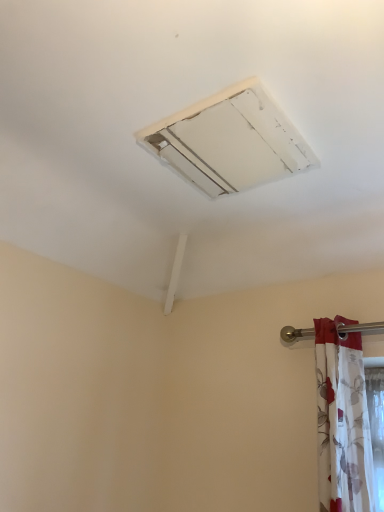
Measure the distance between white matte air conditioning at upper center and camera.

white matte air conditioning at upper center is 36.63 inches from camera.

What do you see at coordinates (230, 141) in the screenshot?
I see `white matte air conditioning at upper center` at bounding box center [230, 141].

Identify the location of white matte air conditioning at upper center. (230, 141).

In order to face white matte air conditioning at upper center, should I rotate leftwards or rightwards?

Rotate right and turn 5.297 degrees.

In order to click on white floral fabric at right in this screenshot , I will do `click(342, 421)`.

Measure the distance between point (338, 370) and camera.

Point (338, 370) is 4.43 feet from camera.

What do you see at coordinates (342, 421) in the screenshot? I see `white floral fabric at right` at bounding box center [342, 421].

Where is `white matte air conditioning at upper center`? white matte air conditioning at upper center is located at coordinates (x=230, y=141).

Visually, is white matte air conditioning at upper center positioned to the left or to the right of white floral fabric at right?

white matte air conditioning at upper center is to the left of white floral fabric at right.

Is white matte air conditioning at upper center behind white floral fabric at right?

No, the depth of white matte air conditioning at upper center is less than that of white floral fabric at right.

Considering the points (267, 142) and (320, 487), which point is behind, point (267, 142) or point (320, 487)?

The point (320, 487) is farther from the camera.

From the image's perspective, does white matte air conditioning at upper center appear lower than white floral fabric at right?

No, from the image's perspective, white matte air conditioning at upper center is not beneath white floral fabric at right.

From a real-world perspective, which object rests below the other?

white floral fabric at right.

Which of these two, white matte air conditioning at upper center or white floral fabric at right, is thinner?

white floral fabric at right is thinner.

Consider the image. Considering the sizes of white matte air conditioning at upper center and white floral fabric at right in the image, is white matte air conditioning at upper center taller or shorter than white floral fabric at right?

white matte air conditioning at upper center is shorter than white floral fabric at right.

Between white matte air conditioning at upper center and white floral fabric at right, which one has larger size?

With larger size is white floral fabric at right.

Based on the photo, is white matte air conditioning at upper center located outside white floral fabric at right?

That's correct, white matte air conditioning at upper center is outside of white floral fabric at right.

Is white matte air conditioning at upper center not close to white floral fabric at right?

No, white matte air conditioning at upper center is not far from white floral fabric at right.

Is white floral fabric at right at the back of white matte air conditioning at upper center?

white matte air conditioning at upper center is not turned away from white floral fabric at right.

Can you tell me how much white matte air conditioning at upper center and white floral fabric at right differ in facing direction?

3.73 degrees.

Locate an element on the screen. The image size is (384, 512). curtain below the white matte air conditioning at upper center (from the image's perspective) is located at coordinates (342, 421).

Considering the relative positions of white floral fabric at right and white matte air conditioning at upper center in the image provided, is white floral fabric at right to the left or to the right of white matte air conditioning at upper center?

Clearly, white floral fabric at right is on the right of white matte air conditioning at upper center in the image.

Which object is more forward, white floral fabric at right or white matte air conditioning at upper center?

Positioned in front is white matte air conditioning at upper center.

Considering the positions of points (337, 362) and (203, 137), is point (337, 362) closer to camera compared to point (203, 137)?

No.

From the image's perspective, between white floral fabric at right and white matte air conditioning at upper center, who is located below?

From the image's view, white floral fabric at right is below.

From the picture: From a real-world perspective, which object stands above the other?

white matte air conditioning at upper center, from a real-world perspective.

Looking at this image, is white floral fabric at right thinner than white matte air conditioning at upper center?

Correct, the width of white floral fabric at right is less than that of white matte air conditioning at upper center.

Can you confirm if white floral fabric at right is shorter than white matte air conditioning at upper center?

Incorrect, the height of white floral fabric at right does not fall short of that of white matte air conditioning at upper center.

Based on their sizes in the image, would you say white floral fabric at right is bigger or smaller than white matte air conditioning at upper center?

In the image, white floral fabric at right appears to be larger than white matte air conditioning at upper center.

Is white floral fabric at right located outside white matte air conditioning at upper center?

white floral fabric at right lies outside white matte air conditioning at upper center's area.

Is white floral fabric at right touching white matte air conditioning at upper center?

No, white floral fabric at right is not making contact with white matte air conditioning at upper center.

Looking at this image, is white floral fabric at right oriented away from white matte air conditioning at upper center?

That's not correct — white floral fabric at right is not looking away from white matte air conditioning at upper center.

Can you tell me how much white floral fabric at right and white matte air conditioning at upper center differ in facing direction?

3.73 degrees separate the facing orientations of white floral fabric at right and white matte air conditioning at upper center.

Find the location of a particular element. air conditioning lying on the left of white floral fabric at right is located at coordinates (230, 141).

I want to click on air conditioning above the white floral fabric at right (from a real-world perspective), so click(230, 141).

Image resolution: width=384 pixels, height=512 pixels. What are the coordinates of `air conditioning on the left of white floral fabric at right` in the screenshot? It's located at (230, 141).